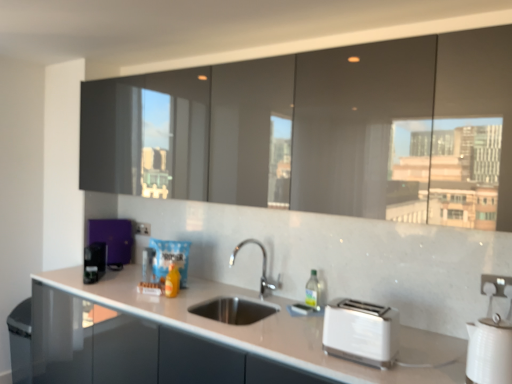
Question: Does purple matte coffee maker at left, arranged as the first appliance when viewed from the back, touch white glossy countertop at center?

Choices:
 (A) yes
 (B) no

Answer: (B)

Question: Does purple matte coffee maker at left, which is the fourth appliance in right-to-left order, appear on the right side of white glossy countertop at center?

Choices:
 (A) yes
 (B) no

Answer: (B)

Question: From the image's perspective, is purple matte coffee maker at left, which is the fourth appliance in right-to-left order, above white glossy countertop at center?

Choices:
 (A) no
 (B) yes

Answer: (B)

Question: Does purple matte coffee maker at left, arranged as the first appliance when viewed from the back, appear on the left side of white glossy countertop at center?

Choices:
 (A) no
 (B) yes

Answer: (B)

Question: Is purple matte coffee maker at left, which ranks as the 4th appliance in front-to-back order, positioned behind white glossy countertop at center?

Choices:
 (A) no
 (B) yes

Answer: (B)

Question: In the image, is white plastic electric outlet at lower right, placed as the first electric outlet when sorted from bottom to top, on the left side or the right side of white plastic toaster at lower right?

Choices:
 (A) left
 (B) right

Answer: (B)

Question: In terms of width, does white plastic electric outlet at lower right, the 2th electric outlet in the back-to-front sequence, look wider or thinner when compared to white plastic toaster at lower right?

Choices:
 (A) thin
 (B) wide

Answer: (A)

Question: From the image's perspective, is white plastic electric outlet at lower right, the 2th electric outlet in the back-to-front sequence, above or below white plastic toaster at lower right?

Choices:
 (A) below
 (B) above

Answer: (B)

Question: Is white plastic electric outlet at lower right, which is the 2th electric outlet in left-to-right order, in front of or behind white plastic toaster at lower right in the image?

Choices:
 (A) front
 (B) behind

Answer: (B)

Question: Is metallic silver toaster at center, placed as the 3th appliance when sorted from left to right, bigger or smaller than purple matte coffee maker at left, the 1th appliance from the left?

Choices:
 (A) big
 (B) small

Answer: (B)

Question: In the image, is metallic silver toaster at center, placed as the 3th appliance when sorted from left to right, on the left side or the right side of purple matte coffee maker at left, the 1th appliance from the left?

Choices:
 (A) right
 (B) left

Answer: (A)

Question: Is metallic silver toaster at center, arranged as the second appliance when viewed from the back, spatially inside purple matte coffee maker at left, which ranks as the 4th appliance in front-to-back order, or outside of it?

Choices:
 (A) inside
 (B) outside

Answer: (B)

Question: From the image's perspective, is metallic silver toaster at center, placed as the 3th appliance when sorted from left to right, above or below purple matte coffee maker at left, arranged as the first appliance when viewed from the back?

Choices:
 (A) above
 (B) below

Answer: (B)

Question: From a real-world perspective, is white glossy electric kettle at lower right, which ranks as the 1th appliance in front-to-back order, physically located above or below translucent plastic bag at center?

Choices:
 (A) below
 (B) above

Answer: (B)

Question: Considering the relative positions of white glossy electric kettle at lower right, which ranks as the 1th appliance in front-to-back order, and translucent plastic bag at center in the image provided, is white glossy electric kettle at lower right, which ranks as the 1th appliance in front-to-back order, to the left or to the right of translucent plastic bag at center?

Choices:
 (A) left
 (B) right

Answer: (B)